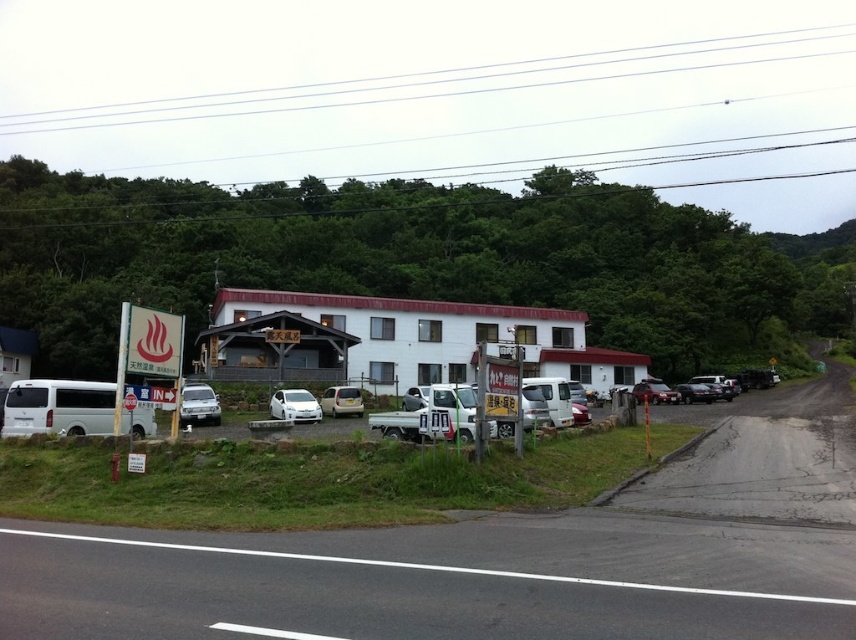
Between white matte car at lower left and white matte car at center, which one is positioned lower?

white matte car at center

Which of these two, white matte car at lower left or white matte car at center, stands taller?

white matte car at lower left

Is point (187, 416) positioned before point (272, 404)?

Yes, it is.

This screenshot has width=856, height=640. Find the location of `white matte car at lower left`. white matte car at lower left is located at coordinates (198, 404).

Does matte silver van at center appear under shiny red sedan at right?

No, matte silver van at center is not below shiny red sedan at right.

The image size is (856, 640). In order to click on matte silver van at center in this screenshot , I will do `click(342, 401)`.

Which is above, shiny red sedan at right or shiny black sedan at right?

shiny black sedan at right is above.

Is shiny red sedan at right to the left of shiny black sedan at right from the viewer's perspective?

Correct, you'll find shiny red sedan at right to the left of shiny black sedan at right.

I want to click on shiny red sedan at right, so (654, 392).